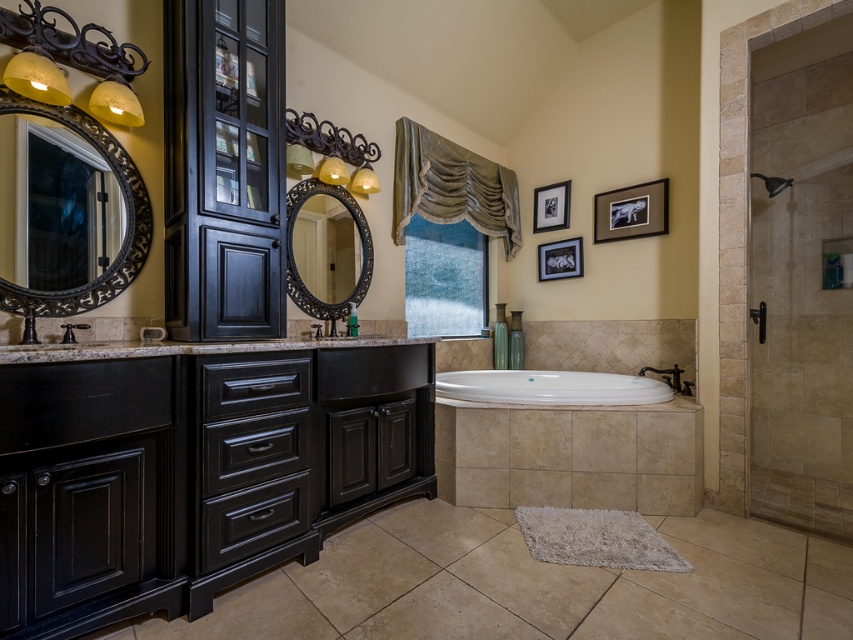
Question: Which object appears farthest from the camera in this image?

Choices:
 (A) black matte picture frame at upper center
 (B) matte black vanity at left
 (C) black matte faucet at center

Answer: (A)

Question: Is white glossy bathtub at center thinner than translucent glass shower at right?

Choices:
 (A) yes
 (B) no

Answer: (B)

Question: Which object appears farthest from the camera in this image?

Choices:
 (A) black matte picture frame at upper center
 (B) wooden picture frame at upper center

Answer: (A)

Question: Does matte black mirror at left have a smaller size compared to white glossy bathtub at center?

Choices:
 (A) no
 (B) yes

Answer: (B)

Question: Which point is closer to the camera?

Choices:
 (A) (260, 416)
 (B) (787, 180)

Answer: (A)

Question: Does matte black vanity at left have a lesser width compared to black matte faucet at center?

Choices:
 (A) no
 (B) yes

Answer: (A)